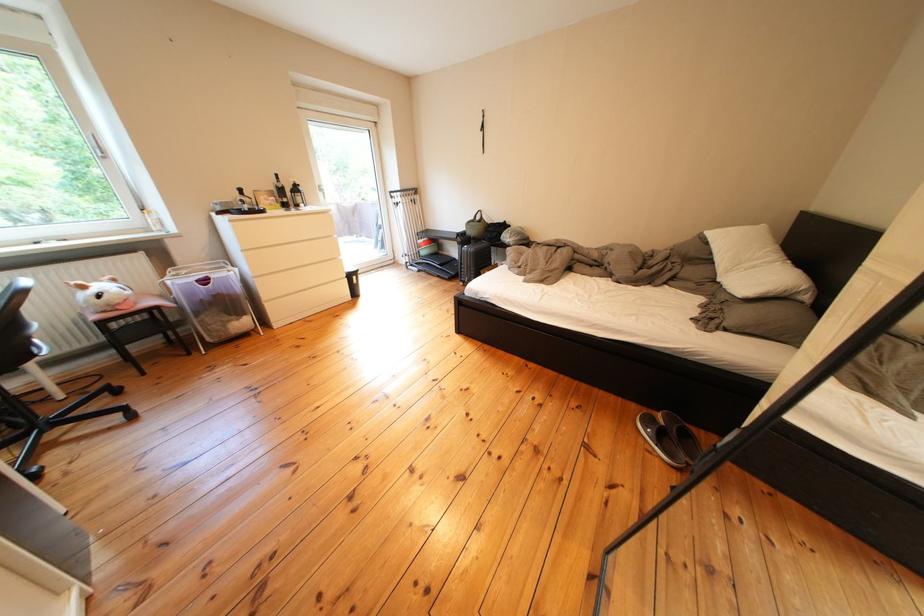
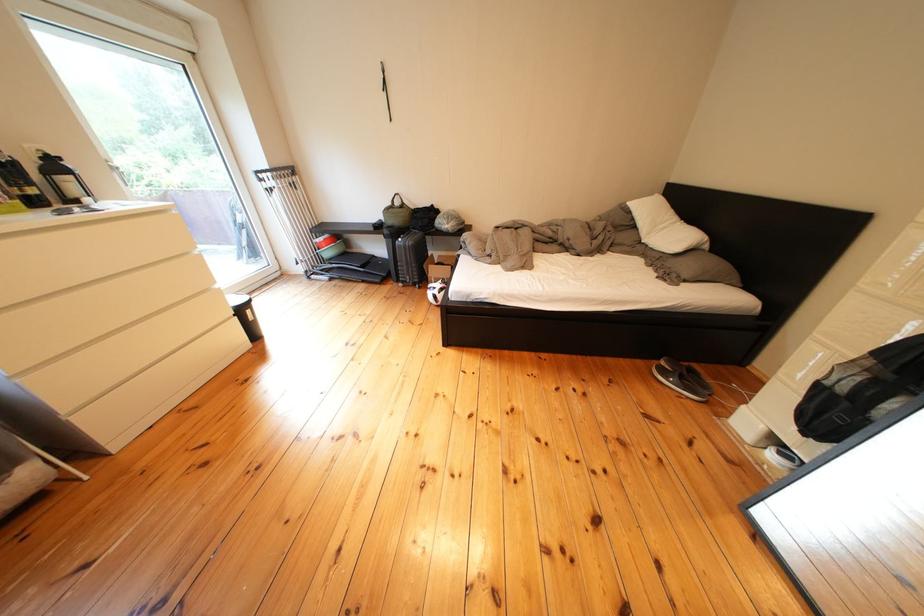
Where in the second image is the point corresponding to the point at 394,244 from the first image?

(259, 248)